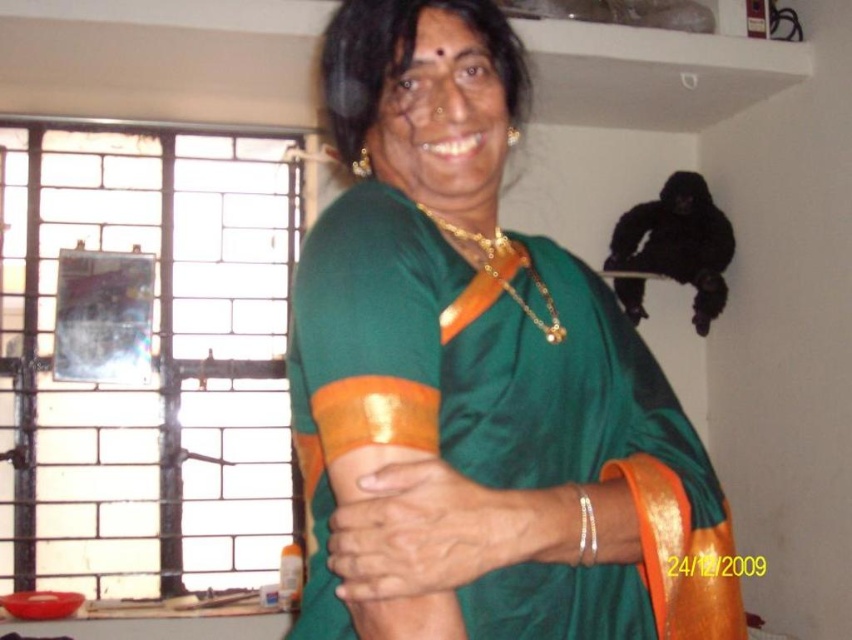
Can you confirm if green silk saree at center is wider than green silk hand at center?

Indeed, green silk saree at center has a greater width compared to green silk hand at center.

Identify the location of green silk saree at center. This screenshot has height=640, width=852. (476, 378).

Locate an element on the screen. Image resolution: width=852 pixels, height=640 pixels. green silk saree at center is located at coordinates (476, 378).

Locate an element on the screen. The height and width of the screenshot is (640, 852). green silk saree at center is located at coordinates (476, 378).

What do you see at coordinates (476, 378) in the screenshot?
I see `green silk saree at center` at bounding box center [476, 378].

Can you confirm if green silk saree at center is taller than gold chain at upper center?

Yes.

The width and height of the screenshot is (852, 640). What are the coordinates of `green silk saree at center` in the screenshot? It's located at (476, 378).

Is green silk hand at center behind gold chain at upper center?

No, it is not.

Which is in front, point (453, 557) or point (419, 205)?

Point (453, 557) is in front.

Does point (417, 570) come behind point (493, 257)?

That is False.

Where is `green silk hand at center`? Image resolution: width=852 pixels, height=640 pixels. green silk hand at center is located at coordinates (419, 529).